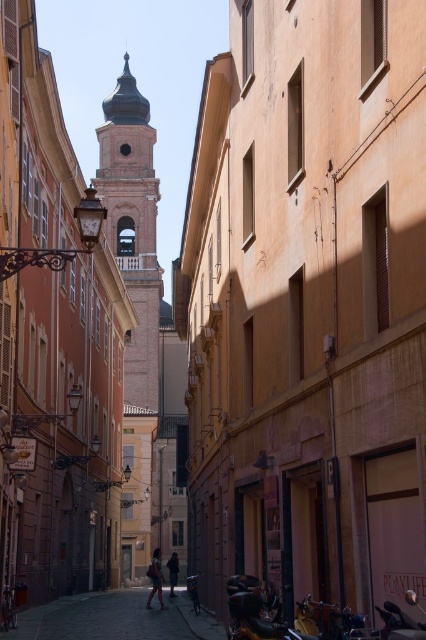
You are standing at the center of the street in the historic European town. There is a point marked at coordinates point (154, 396). Can you estimate how far this point is from your current position?

The point (154, 396) is 204.91 meters away from the camera, so it is approximately 204.91 meters away from your current position.

From the picture: You are a delivery person carrying a package that requires a 250 feet delivery radius. You are currently at the smooth beige bell tower at center and need to deliver it to the dark brown leather jacket at center. Can you make the delivery within the radius?

The distance between the smooth beige bell tower at center and the dark brown leather jacket at center is 258.84 feet, which exceeds the 250 feet delivery radius. Therefore, you cannot make the delivery within the radius.